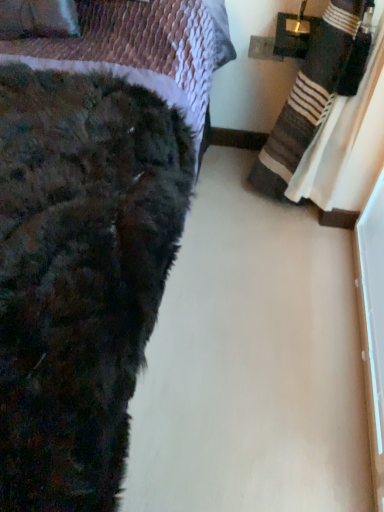
Question: Can you confirm if velvet purple throw pillow at upper left is taller than fuzzy black blanket at lower left?

Choices:
 (A) no
 (B) yes

Answer: (A)

Question: Does velvet purple throw pillow at upper left touch fuzzy black blanket at lower left?

Choices:
 (A) no
 (B) yes

Answer: (A)

Question: Considering the relative positions of velvet purple throw pillow at upper left and fuzzy black blanket at lower left in the image provided, is velvet purple throw pillow at upper left behind fuzzy black blanket at lower left?

Choices:
 (A) yes
 (B) no

Answer: (A)

Question: Is velvet purple throw pillow at upper left facing away from fuzzy black blanket at lower left?

Choices:
 (A) no
 (B) yes

Answer: (B)

Question: Does velvet purple throw pillow at upper left have a smaller size compared to fuzzy black blanket at lower left?

Choices:
 (A) no
 (B) yes

Answer: (B)

Question: From a real-world perspective, is velvet purple throw pillow at upper left positioned under fuzzy black blanket at lower left based on gravity?

Choices:
 (A) no
 (B) yes

Answer: (A)

Question: Is fuzzy black blanket at lower left at the left side of velvet purple throw pillow at upper left?

Choices:
 (A) yes
 (B) no

Answer: (B)

Question: Is fuzzy black blanket at lower left turned away from velvet purple throw pillow at upper left?

Choices:
 (A) yes
 (B) no

Answer: (A)

Question: Considering the relative sizes of fuzzy black blanket at lower left and velvet purple throw pillow at upper left in the image provided, is fuzzy black blanket at lower left thinner than velvet purple throw pillow at upper left?

Choices:
 (A) no
 (B) yes

Answer: (A)

Question: Can you see fuzzy black blanket at lower left touching velvet purple throw pillow at upper left?

Choices:
 (A) yes
 (B) no

Answer: (B)

Question: From the image's perspective, is fuzzy black blanket at lower left on velvet purple throw pillow at upper left?

Choices:
 (A) yes
 (B) no

Answer: (B)

Question: Is velvet purple throw pillow at upper left surrounded by fuzzy black blanket at lower left?

Choices:
 (A) yes
 (B) no

Answer: (A)

Question: Is striped cotton blanket at right in front of velvet purple throw pillow at upper left?

Choices:
 (A) no
 (B) yes

Answer: (B)